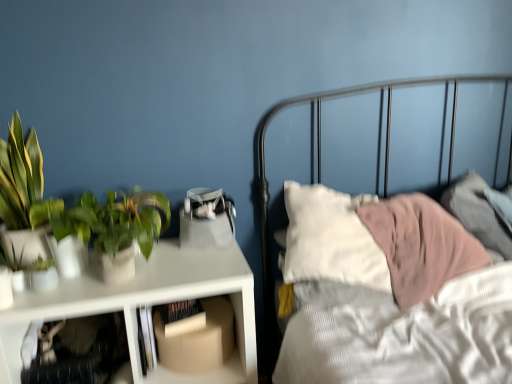
Question: Which direction should I rotate to look at cardboard box at lower center, arranged as the second shelf when viewed from the left, — up or down?

Choices:
 (A) down
 (B) up

Answer: (A)

Question: Can you confirm if white matte table at left is positioned to the left of green matte plant at left?

Choices:
 (A) no
 (B) yes

Answer: (A)

Question: From the image's perspective, is white matte table at left beneath green matte plant at left?

Choices:
 (A) no
 (B) yes

Answer: (B)

Question: Considering the relative sizes of white matte table at left and green matte plant at left in the image provided, is white matte table at left bigger than green matte plant at left?

Choices:
 (A) no
 (B) yes

Answer: (B)

Question: Is the depth of white matte table at left greater than that of green matte plant at left?

Choices:
 (A) yes
 (B) no

Answer: (A)

Question: Are white matte table at left and green matte plant at left located far from each other?

Choices:
 (A) yes
 (B) no

Answer: (B)

Question: Considering the relative sizes of white matte table at left and green matte plant at left in the image provided, is white matte table at left taller than green matte plant at left?

Choices:
 (A) yes
 (B) no

Answer: (A)

Question: Does green matte plant at left have a lesser width compared to translucent plastic shelf at lower left, the first shelf when ordered from left to right?

Choices:
 (A) yes
 (B) no

Answer: (A)

Question: Is green matte plant at left closer to camera compared to translucent plastic shelf at lower left, acting as the 2th shelf starting from the right?

Choices:
 (A) yes
 (B) no

Answer: (B)

Question: From a real-world perspective, does green matte plant at left stand above translucent plastic shelf at lower left, acting as the 2th shelf starting from the right?

Choices:
 (A) no
 (B) yes

Answer: (B)

Question: From the image's perspective, is green matte plant at left under translucent plastic shelf at lower left, the first shelf when ordered from left to right?

Choices:
 (A) yes
 (B) no

Answer: (B)

Question: Can you confirm if green matte plant at left is taller than translucent plastic shelf at lower left, the first shelf when ordered from left to right?

Choices:
 (A) yes
 (B) no

Answer: (A)

Question: Is green matte plant at left further to the viewer compared to translucent plastic shelf at lower left, acting as the 2th shelf starting from the right?

Choices:
 (A) no
 (B) yes

Answer: (B)

Question: Does translucent plastic shelf at lower left, the first shelf when ordered from left to right, have a greater width compared to white matte table at left?

Choices:
 (A) yes
 (B) no

Answer: (A)